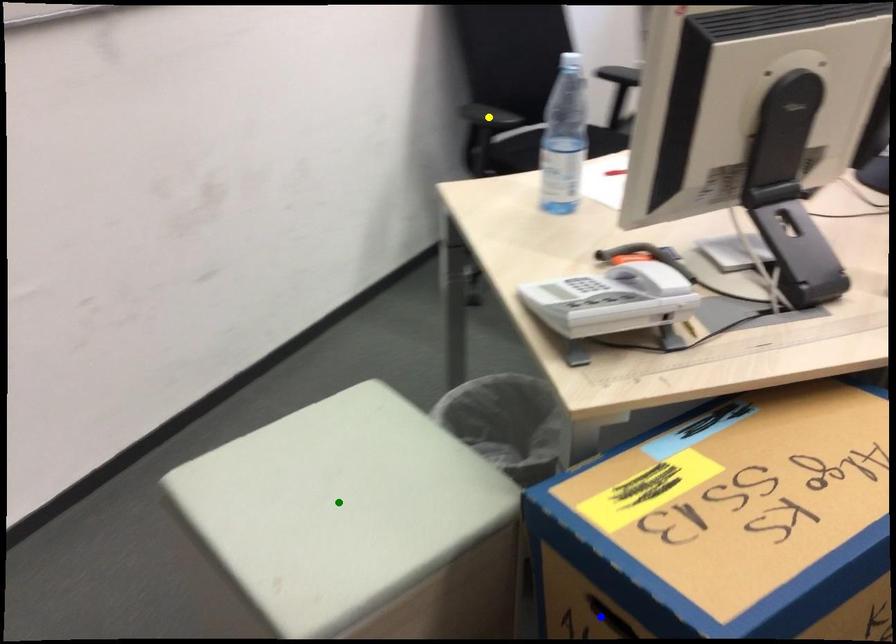
Order these from farthest to nearest:
1. green point
2. blue point
3. yellow point

yellow point < green point < blue point